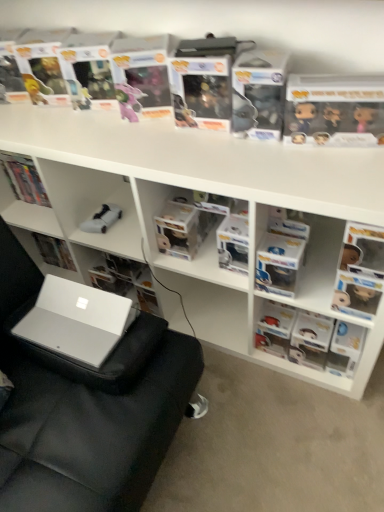
This screenshot has width=384, height=512. In order to click on blank space situated above white plastic shelves at upper center (from a real-world perspective) in this screenshot , I will do `click(165, 136)`.